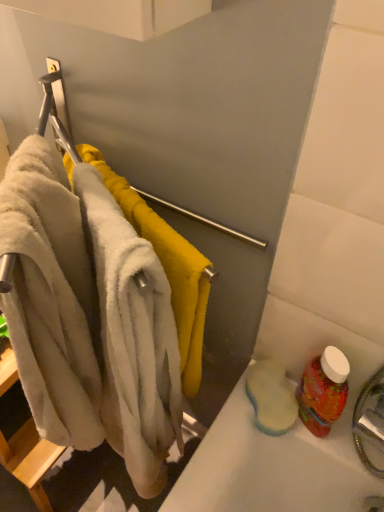
Question: Can you confirm if red plastic bottle at lower right is taller than beige fluffy bath towel at left?

Choices:
 (A) yes
 (B) no

Answer: (B)

Question: Considering the relative sizes of red plastic bottle at lower right and beige fluffy bath towel at left in the image provided, is red plastic bottle at lower right smaller than beige fluffy bath towel at left?

Choices:
 (A) no
 (B) yes

Answer: (B)

Question: From a real-world perspective, is red plastic bottle at lower right positioned under beige fluffy bath towel at left based on gravity?

Choices:
 (A) no
 (B) yes

Answer: (B)

Question: Is red plastic bottle at lower right looking in the opposite direction of beige fluffy bath towel at left?

Choices:
 (A) no
 (B) yes

Answer: (A)

Question: Considering the relative positions of red plastic bottle at lower right and beige fluffy bath towel at left in the image provided, is red plastic bottle at lower right to the right of beige fluffy bath towel at left from the viewer's perspective?

Choices:
 (A) yes
 (B) no

Answer: (A)

Question: From the image's perspective, would you say red plastic bottle at lower right is positioned over beige fluffy bath towel at left?

Choices:
 (A) no
 (B) yes

Answer: (A)

Question: Is soft white towel at left to the right of beige fluffy bath towel at left from the viewer's perspective?

Choices:
 (A) no
 (B) yes

Answer: (B)

Question: From the image's perspective, is soft white towel at left beneath beige fluffy bath towel at left?

Choices:
 (A) no
 (B) yes

Answer: (A)

Question: Is soft white towel at left with beige fluffy bath towel at left?

Choices:
 (A) no
 (B) yes

Answer: (A)

Question: Is soft white towel at left to the left of beige fluffy bath towel at left from the viewer's perspective?

Choices:
 (A) no
 (B) yes

Answer: (A)

Question: Can you confirm if soft white towel at left is bigger than beige fluffy bath towel at left?

Choices:
 (A) no
 (B) yes

Answer: (A)

Question: Can you confirm if soft white towel at left is thinner than beige fluffy bath towel at left?

Choices:
 (A) yes
 (B) no

Answer: (A)

Question: Is soft white towel at left far away from red plastic bottle at lower right?

Choices:
 (A) no
 (B) yes

Answer: (A)